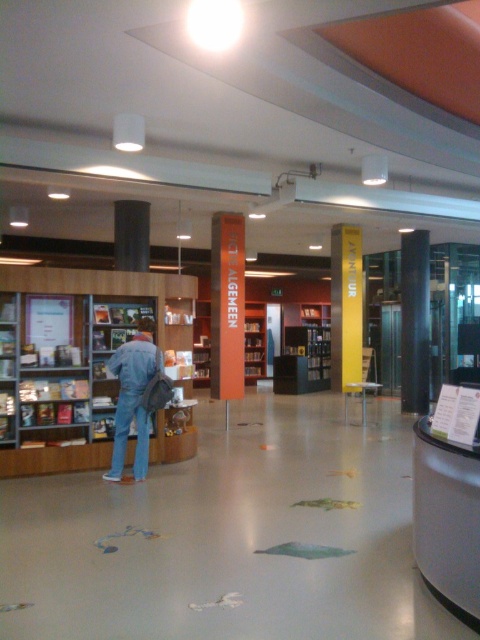
Question: Which of the following is the farthest from the observer?

Choices:
 (A) (248, 374)
 (B) (1, 320)

Answer: (A)

Question: Does wooden bookshelf at left appear on the right side of orange matte bookshelf at center?

Choices:
 (A) yes
 (B) no

Answer: (B)

Question: Estimate the real-world distances between objects in this image. Which object is closer to the wooden bookshelf at left?

Choices:
 (A) orange matte bookshelf at center
 (B) denim jacket at center
 (C) metallic gray desk at lower right

Answer: (B)

Question: Which of the following is the farthest from the observer?

Choices:
 (A) orange matte bookshelf at center
 (B) metallic gray desk at lower right

Answer: (A)

Question: Considering the relative positions of wooden bookshelf at left and metallic gray desk at lower right in the image provided, where is wooden bookshelf at left located with respect to metallic gray desk at lower right?

Choices:
 (A) below
 (B) above

Answer: (B)

Question: In this image, where is wooden bookshelf at left located relative to denim jacket at center?

Choices:
 (A) right
 (B) left

Answer: (B)